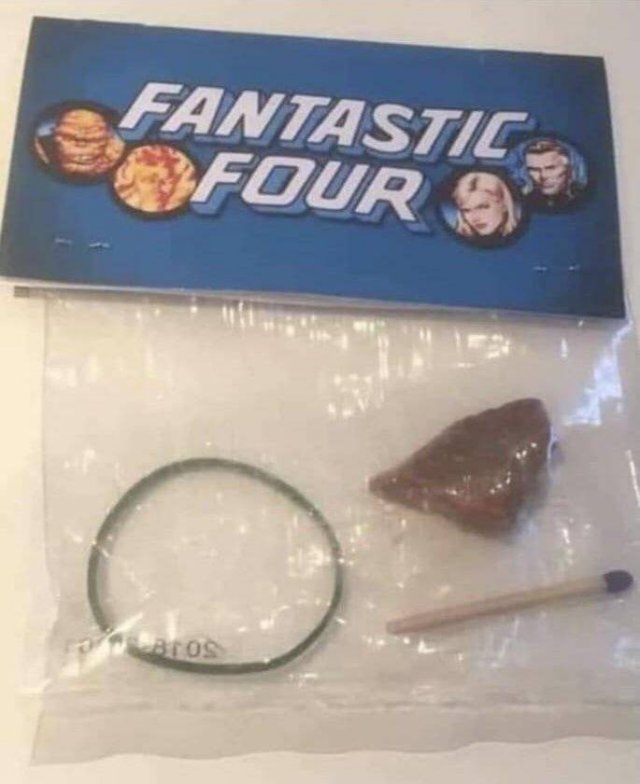
I want to click on countertop, so click(525, 757), click(18, 590).